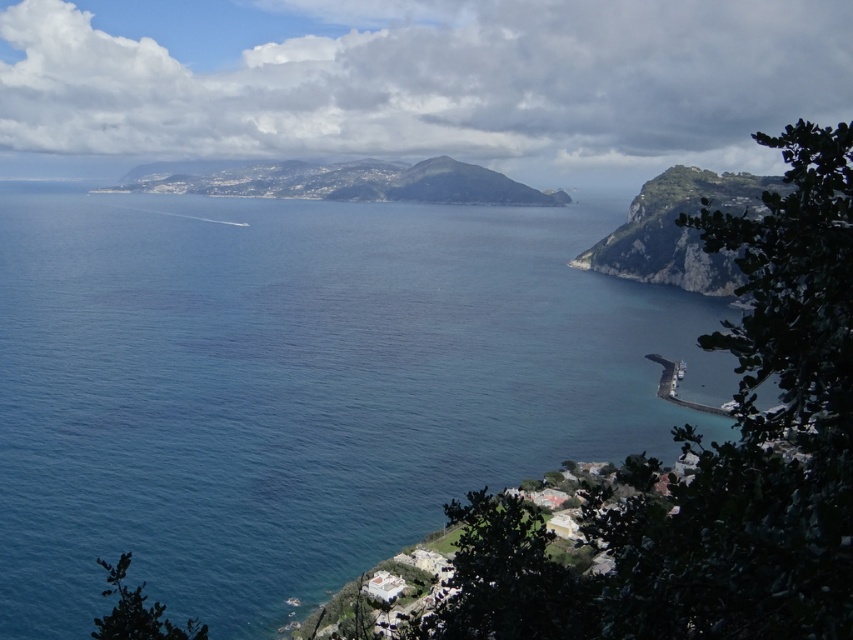
You are standing on the rugged stone cliff at right and want to see the blue water at center. Which direction should you look to see it?

The blue water at center is in front of the rugged stone cliff at right, so you should look forward from the rugged stone cliff at right to see the blue water at center.

You are standing on the rugged stone cliff at right and want to get to the blue water at center. Which direction should you move to reach it?

You should move to your left to reach the blue water at center since it is located to the left of the rugged stone cliff at right.

You are a photographer planning to capture the rugged stone cliff at right and the blue water at center in a single shot. Based on their positions, which object should you focus on first to ensure both are in frame?

The blue water at center is located above the rugged stone cliff at right, so you should focus on the rugged stone cliff at right first to ensure both are in frame.